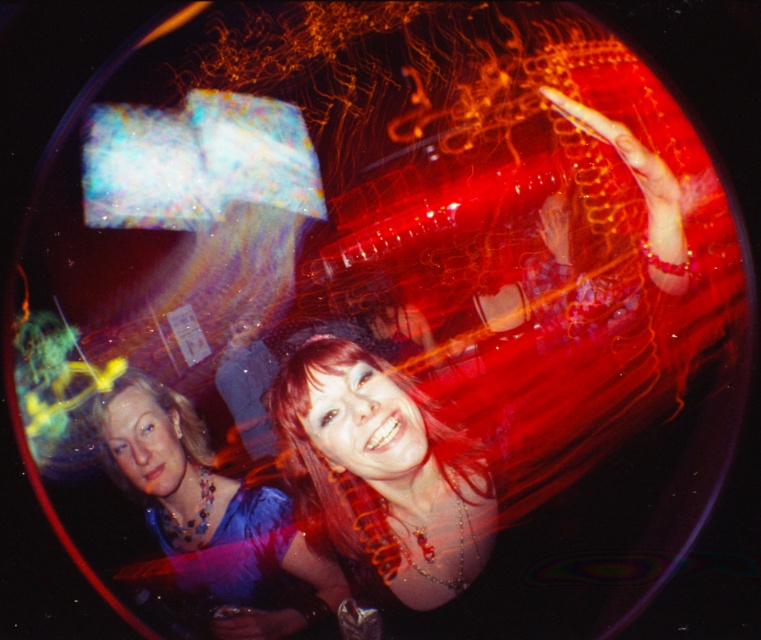
In the scene shown: Can you confirm if shiny red hair at center is wider than shiny blue dress at lower left?

In fact, shiny red hair at center might be narrower than shiny blue dress at lower left.

Measure the distance between shiny red hair at center and camera.

4.76 feet

This screenshot has width=761, height=640. I want to click on shiny red hair at center, so click(x=381, y=472).